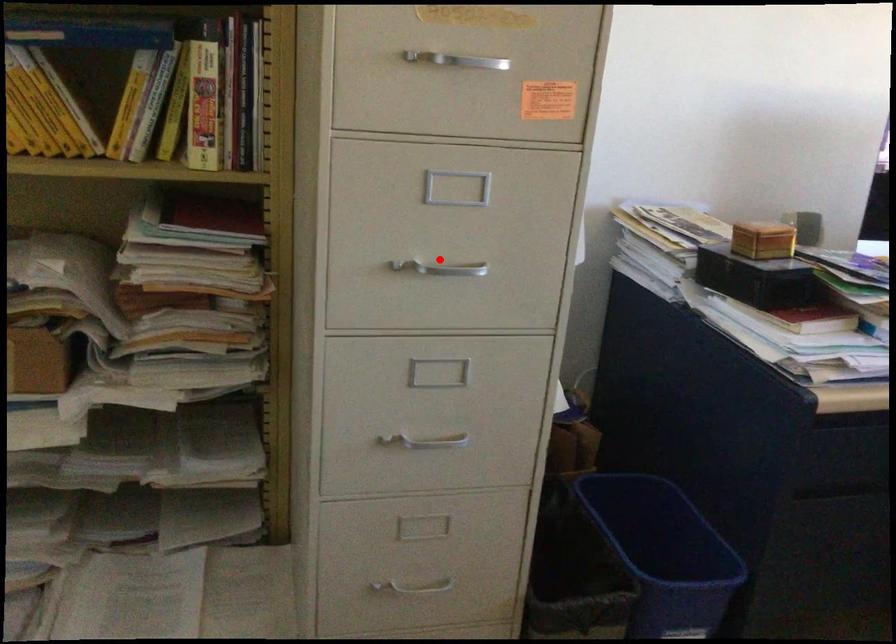
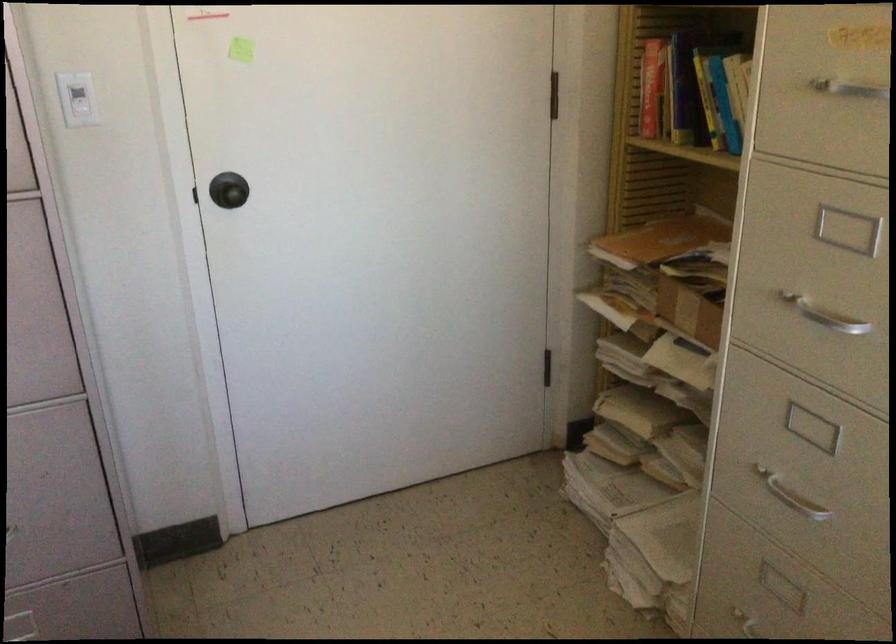
Question: I am providing you with two images of the same scene from different viewpoints. A red point is shown in image1. For the corresponding object point in image2, is it positioned nearer or farther from the camera?

Choices:
 (A) Nearer
 (B) Farther

Answer: (A)